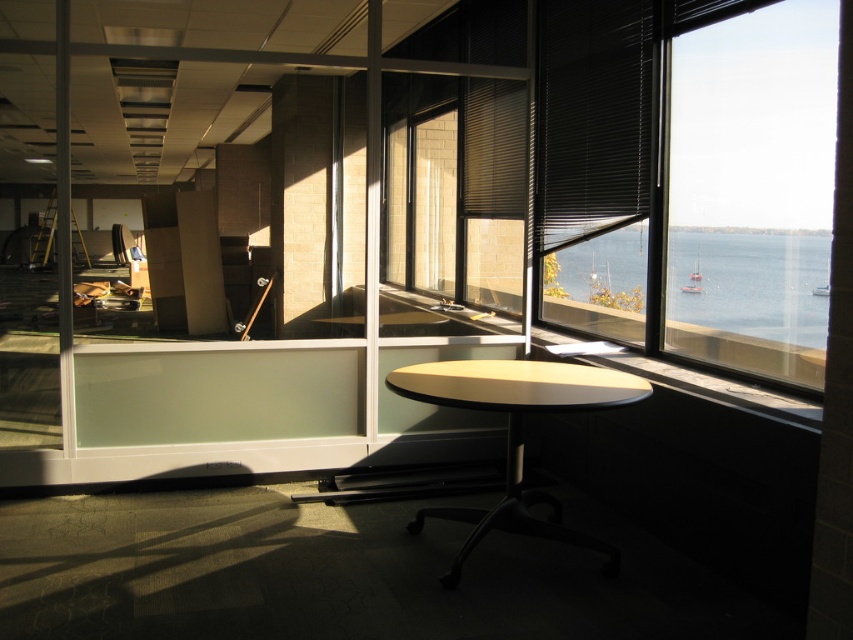
Who is shorter, blue water at window right or light beige laminate table at center?

blue water at window right is shorter.

Does blue water at window right have a greater height compared to light beige laminate table at center?

No.

Between point (819, 244) and point (399, 381), which one is positioned behind?

The point (399, 381) is more distant.

Where is `blue water at window right`? The width and height of the screenshot is (853, 640). blue water at window right is located at coordinates (749, 280).

Between transparent glass window at right and light beige laminate table at center, which one is positioned lower?

light beige laminate table at center

Does transparent glass window at right come in front of light beige laminate table at center?

No, transparent glass window at right is behind light beige laminate table at center.

Between point (828, 173) and point (488, 384), which one is positioned in front?

Point (828, 173)

Where is `transparent glass window at right`? transparent glass window at right is located at coordinates (751, 189).

Does transparent glass window at right appear on the right side of blue water at window right?

No, transparent glass window at right is not to the right of blue water at window right.

Between transparent glass window at right and blue water at window right, which one is positioned lower?

blue water at window right

Measure the distance between transparent glass window at right and camera.

transparent glass window at right is 2.84 meters from camera.

I want to click on transparent glass window at right, so click(751, 189).